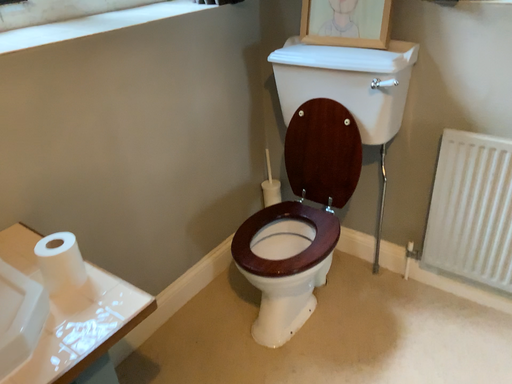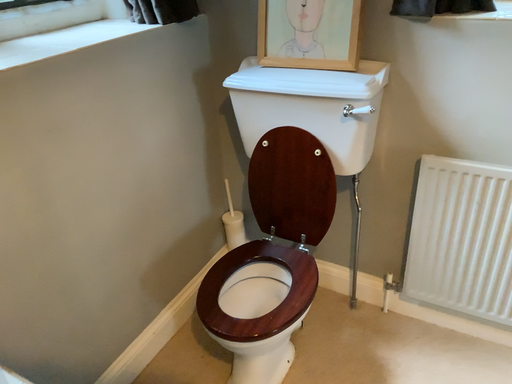
Question: How did the camera likely rotate when shooting the video?

Choices:
 (A) rotated right
 (B) rotated left

Answer: (A)